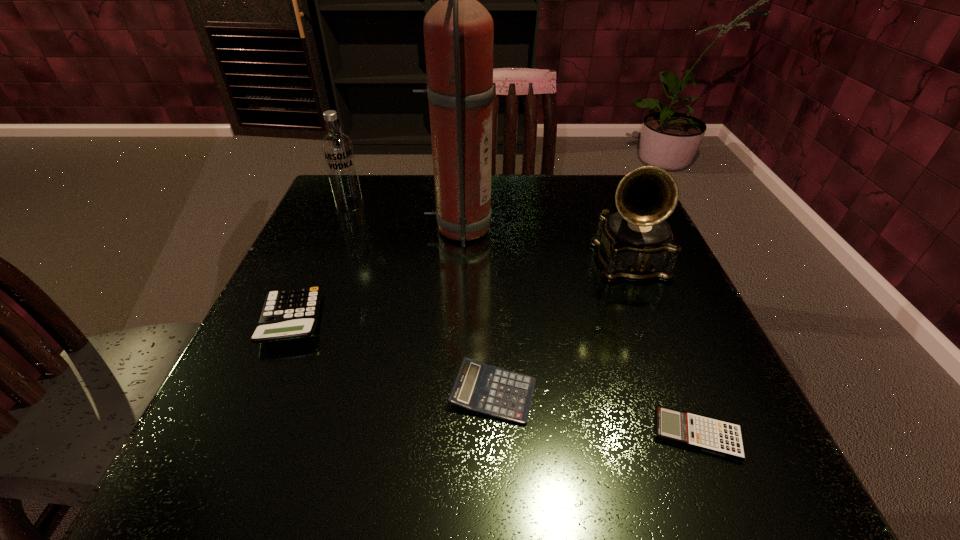
Where is `the tallest object`? the tallest object is located at coordinates point(458,30).

This screenshot has height=540, width=960. Find the location of `phonograph record`. phonograph record is located at coordinates (636, 243).

The image size is (960, 540). In order to click on vodka in this screenshot , I will do `click(337, 149)`.

Locate an element on the screen. Image resolution: width=960 pixels, height=540 pixels. the fourth tallest object is located at coordinates (292, 313).

The height and width of the screenshot is (540, 960). What are the coordinates of `the tallest calculator` in the screenshot? It's located at (292, 313).

The image size is (960, 540). Identify the location of the second shortest object. (478, 387).

This screenshot has width=960, height=540. Identify the location of the second shortest calculator. (478, 387).

Find the location of a particular element. Image resolution: width=960 pixels, height=540 pixels. the rightmost calculator is located at coordinates (721, 438).

Image resolution: width=960 pixels, height=540 pixels. Identify the location of the shortest object. (721, 438).

The image size is (960, 540). In order to click on vacant space located on the side of the fire extinguisher with the label and nozzle in this screenshot , I will do coord(557,229).